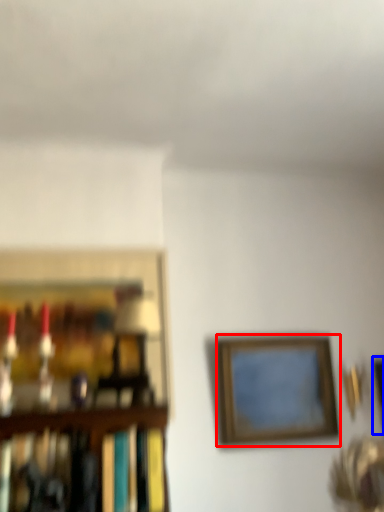
Question: Which of the following is the farthest to the observer, picture frame (highlighted by a red box) or picture frame (highlighted by a blue box)?

Choices:
 (A) picture frame
 (B) picture frame

Answer: (B)